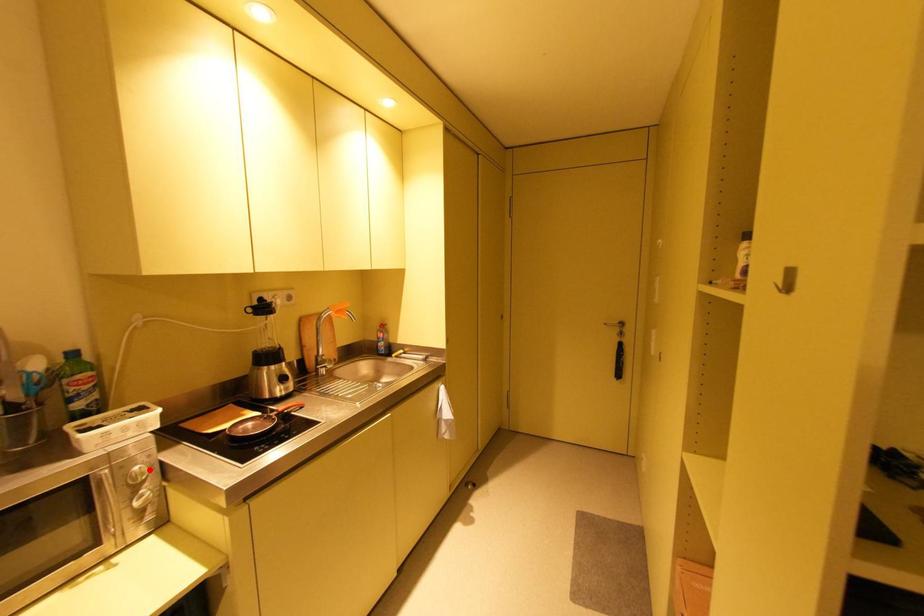
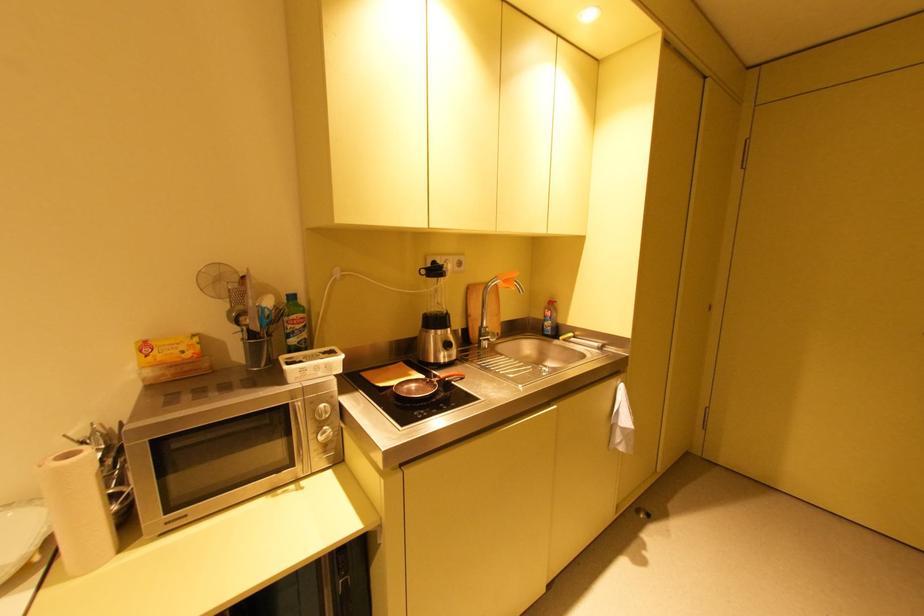
Question: I am providing you with two images of the same scene from different viewpoints. A red point is marked on the first image. At the location where the point appears in image 1, is it still visible in image 2?

Choices:
 (A) Yes
 (B) No

Answer: (A)